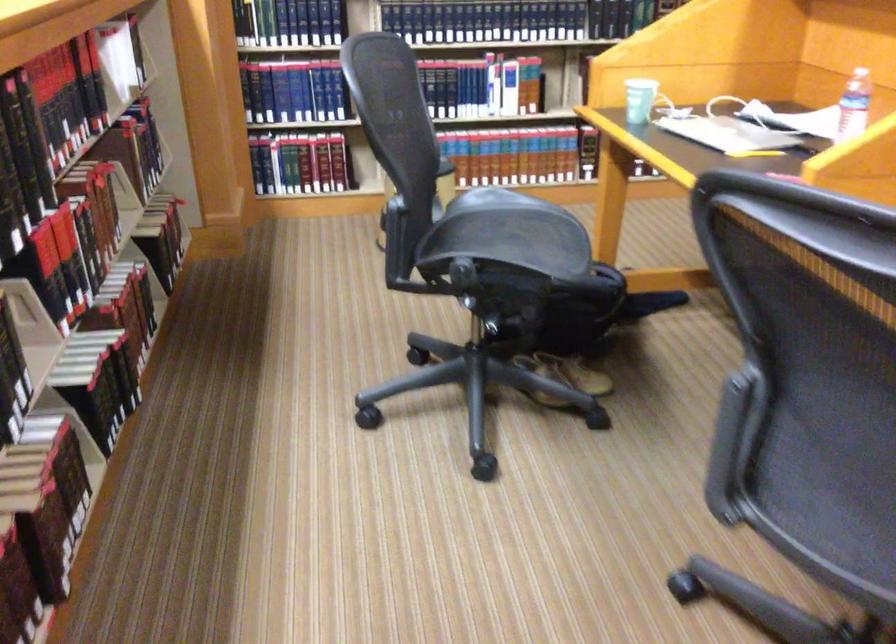
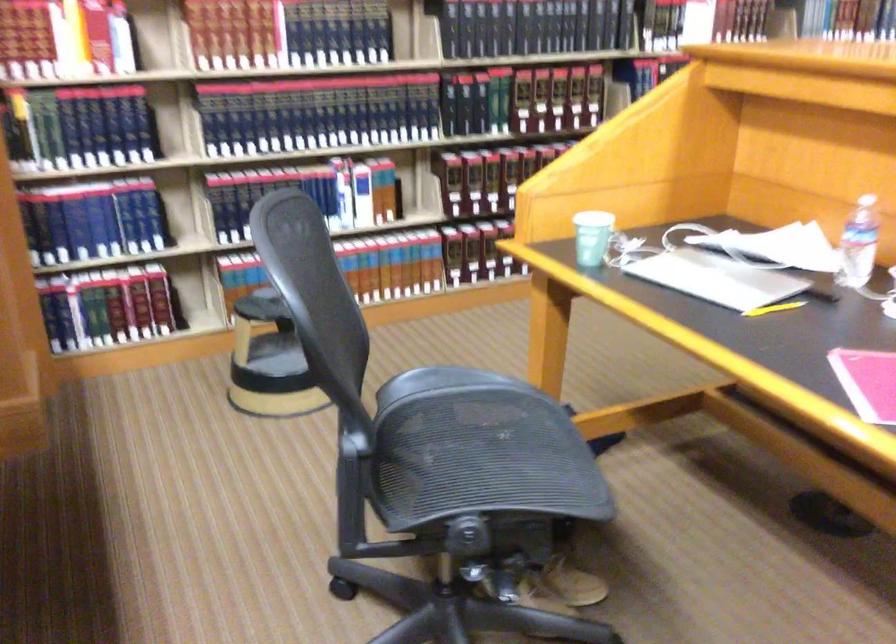
What movement of the cameraman would produce the second image?

The cameraman moved toward left, forward.